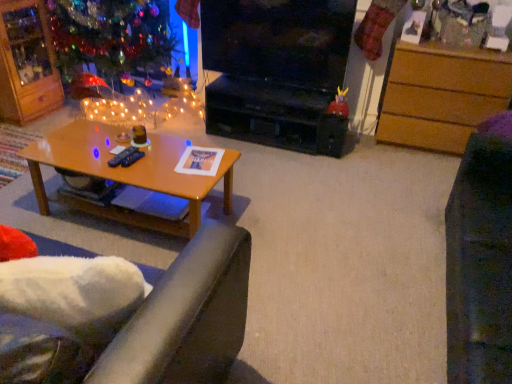
Where is `vacant area situated to the left side of matte brown coffee cup at center`? vacant area situated to the left side of matte brown coffee cup at center is located at coordinates (100, 135).